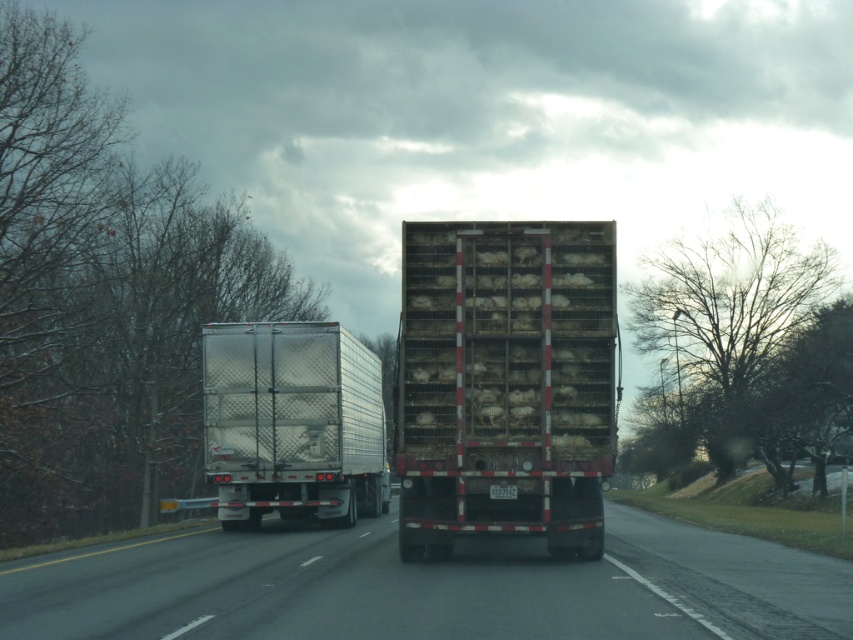
Based on the photo, you are driving a car and see the silver metallic trailer truck at center ahead on the black rubber highway at center. Can you safely pass the truck on either side?

The black rubber highway at center is below the silver metallic trailer truck at center, which means the truck is on the highway. Since the highway has two lanes, you can safely pass the truck on either side as long as there is no oncoming traffic and the lanes are clear.

You are driving a car and see a large truck carrying a trailer with live chickens ahead. Your car is at point (482,224). The truck is 50.65 feet away from you. Can you safely stop before hitting the truck if you apply the brakes immediately?

The distance between your car at point (482,224) and the truck is 50.65 feet. To determine if you can safely stop, you need to know your current speed and the braking distance required. Without this information, it is impossible to confirm safety.